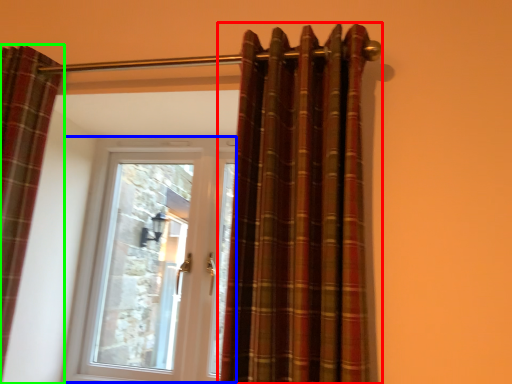
Question: Based on their relative distances, which object is farther from curtain (highlighted by a red box)? Choose from door (highlighted by a blue box) and curtain (highlighted by a green box).

Choices:
 (A) door
 (B) curtain

Answer: (A)